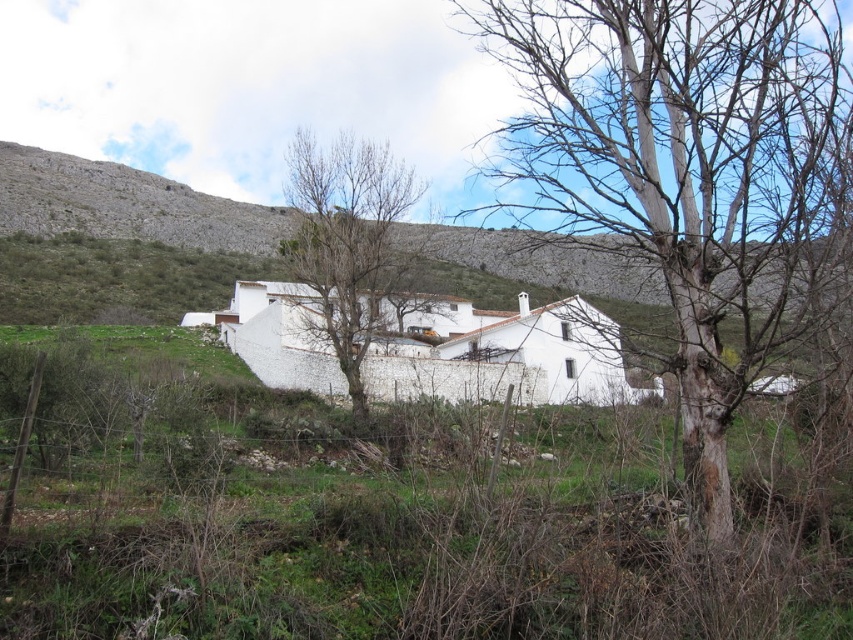
You are a hiker standing at the base of the hillside. You see the white smooth hillside at center and the bare branches at center. Which object is farther away from you?

The white smooth hillside at center is 155.45 meters from the bare branches at center, so the white smooth hillside at center is farther away from you.

You are standing at the base of the white smooth hillside at center and want to walk towards the bare wood tree at center. In which direction should you head?

You should head to the right because the bare wood tree at center is located to the right of the white smooth hillside at center.